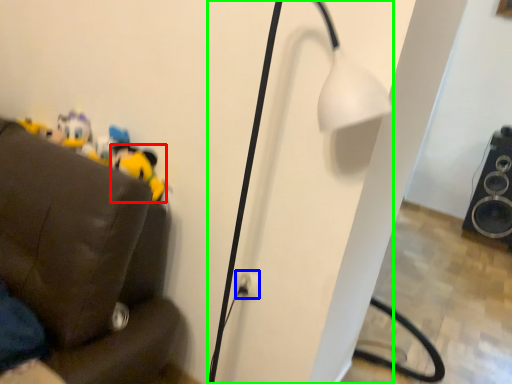
Question: Based on their relative distances, which object is nearer to toy (highlighted by a red box)? Choose from electric outlet (highlighted by a blue box) and lamp (highlighted by a green box).

Choices:
 (A) electric outlet
 (B) lamp

Answer: (A)